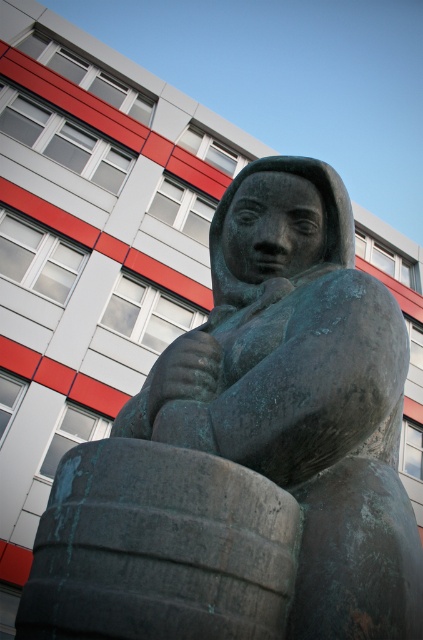
Question: Can you confirm if green patina stone statue at center is positioned to the right of greenish-brown rubber tire at lower left?

Choices:
 (A) no
 (B) yes

Answer: (B)

Question: In this image, where is green patina stone statue at center located relative to greenish-brown rubber tire at lower left?

Choices:
 (A) left
 (B) right

Answer: (B)

Question: Does green patina stone statue at center appear on the right side of greenish-brown rubber tire at lower left?

Choices:
 (A) yes
 (B) no

Answer: (A)

Question: Among these points, which one is farthest from the camera?

Choices:
 (A) (90, 557)
 (B) (112, 476)

Answer: (B)

Question: Which point is closer to the camera?

Choices:
 (A) (x=332, y=301)
 (B) (x=219, y=509)

Answer: (B)